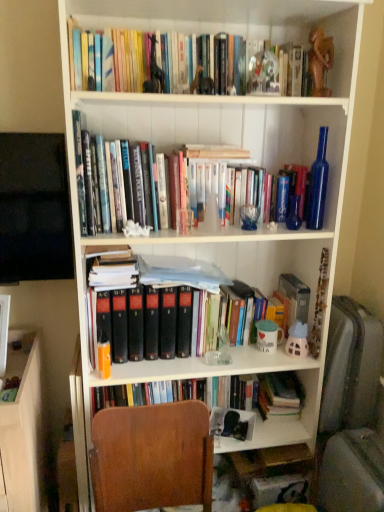
Question: Is hardcover books at upper center, placed as the first book when sorted from top to bottom, facing towards hardcover books at lower center, arranged as the 2th book when viewed from the front?

Choices:
 (A) yes
 (B) no

Answer: (B)

Question: Does hardcover books at upper center, which is counted as the 2th book, starting from the bottom, come behind hardcover books at lower center, the 2th book when ordered from top to bottom?

Choices:
 (A) no
 (B) yes

Answer: (A)

Question: Can you confirm if hardcover books at upper center, placed as the first book when sorted from top to bottom, is thinner than hardcover books at lower center, the 2th book when ordered from top to bottom?

Choices:
 (A) yes
 (B) no

Answer: (A)

Question: Can we say hardcover books at upper center, placed as the first book when sorted from top to bottom, lies outside hardcover books at lower center, the 2th book when ordered from top to bottom?

Choices:
 (A) yes
 (B) no

Answer: (A)

Question: Can you confirm if hardcover books at upper center, which is counted as the 2th book, starting from the bottom, is bigger than hardcover books at lower center, the 2th book when ordered from top to bottom?

Choices:
 (A) no
 (B) yes

Answer: (B)

Question: Does hardcover books at upper center, which is counted as the 2th book, starting from the bottom, have a greater width compared to hardcover books at lower center, the 2th book when ordered from top to bottom?

Choices:
 (A) yes
 (B) no

Answer: (B)

Question: Is brown wood chair at lower center to the right of hardcover books at lower center, arranged as the 2th book when viewed from the front, from the viewer's perspective?

Choices:
 (A) no
 (B) yes

Answer: (A)

Question: Are brown wood chair at lower center and hardcover books at lower center, the 1th book when ordered from bottom to top, located far from each other?

Choices:
 (A) yes
 (B) no

Answer: (B)

Question: Is brown wood chair at lower center turned away from hardcover books at lower center, the 2th book when ordered from top to bottom?

Choices:
 (A) yes
 (B) no

Answer: (B)

Question: Is brown wood chair at lower center oriented towards hardcover books at lower center, arranged as the 2th book when viewed from the front?

Choices:
 (A) yes
 (B) no

Answer: (B)

Question: Is brown wood chair at lower center touching hardcover books at lower center, the 1th book when ordered from bottom to top?

Choices:
 (A) yes
 (B) no

Answer: (B)

Question: Is brown wood chair at lower center wider than hardcover books at lower center, the 2th book when ordered from top to bottom?

Choices:
 (A) no
 (B) yes

Answer: (B)

Question: Is hardcover books at upper center, acting as the first book starting from the front, outside of hardcover book at center?

Choices:
 (A) yes
 (B) no

Answer: (A)